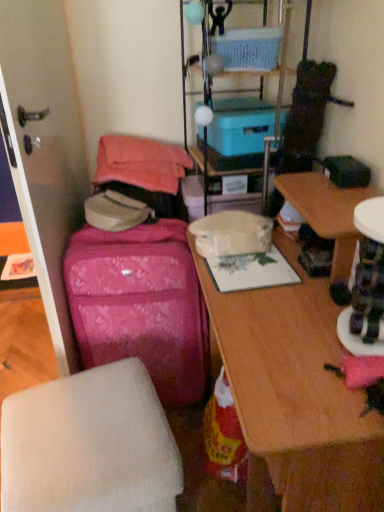
Where is `vacant point above white matte ottoman at lower left (from a real-world perspective)`? vacant point above white matte ottoman at lower left (from a real-world perspective) is located at coordinates (83, 423).